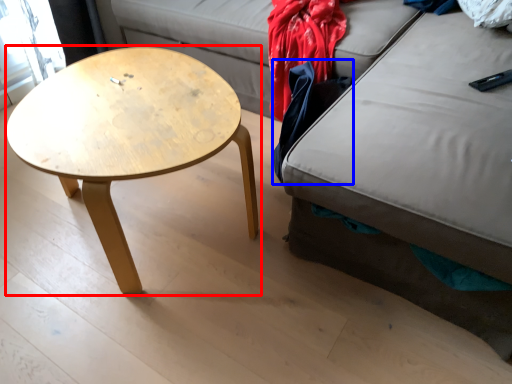
Question: Which point is further to the camera, coffee table (highlighted by a red box) or clothing (highlighted by a blue box)?

Choices:
 (A) coffee table
 (B) clothing

Answer: (B)